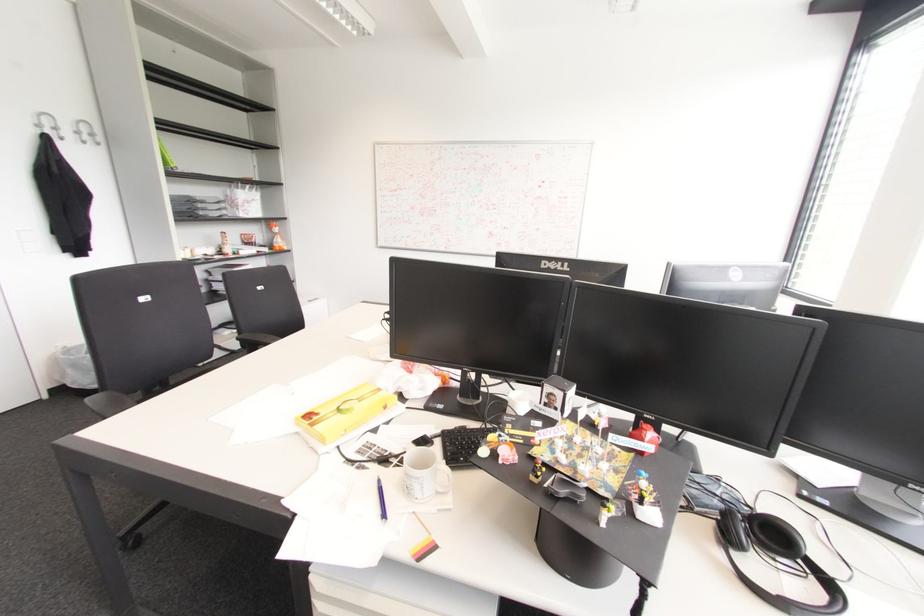
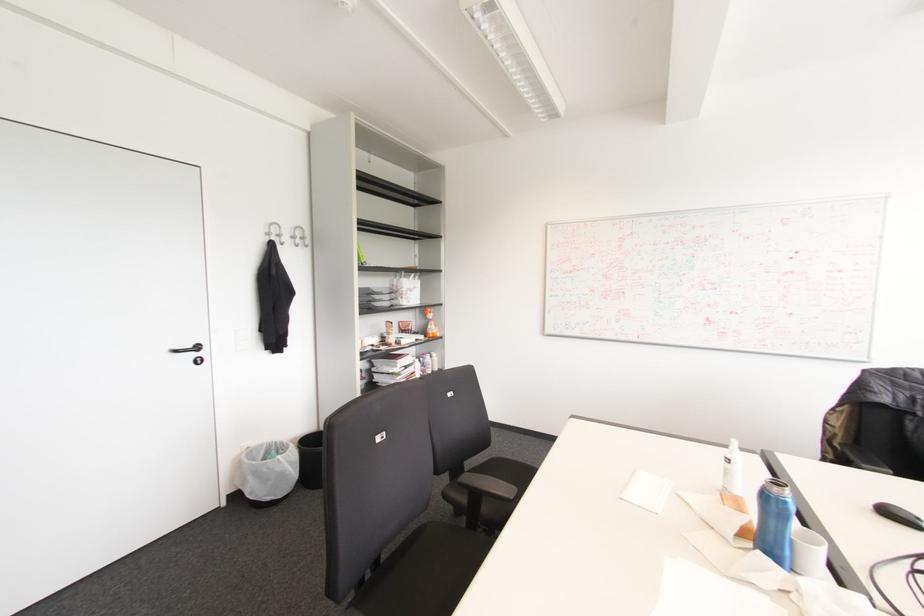
Locate, in the second image, the point that corresponds to pixel 38 126 in the first image.

(266, 233)